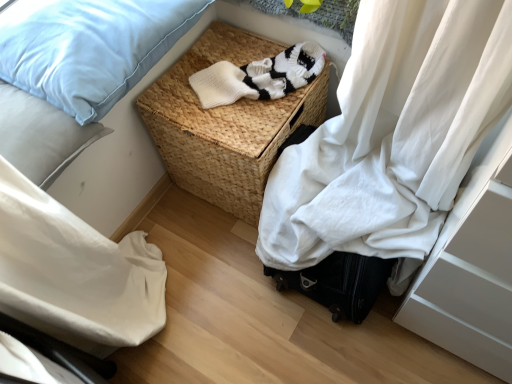
The width and height of the screenshot is (512, 384). In order to click on vacant area to the left of black hard suitcase at lower right in this screenshot , I will do `click(214, 287)`.